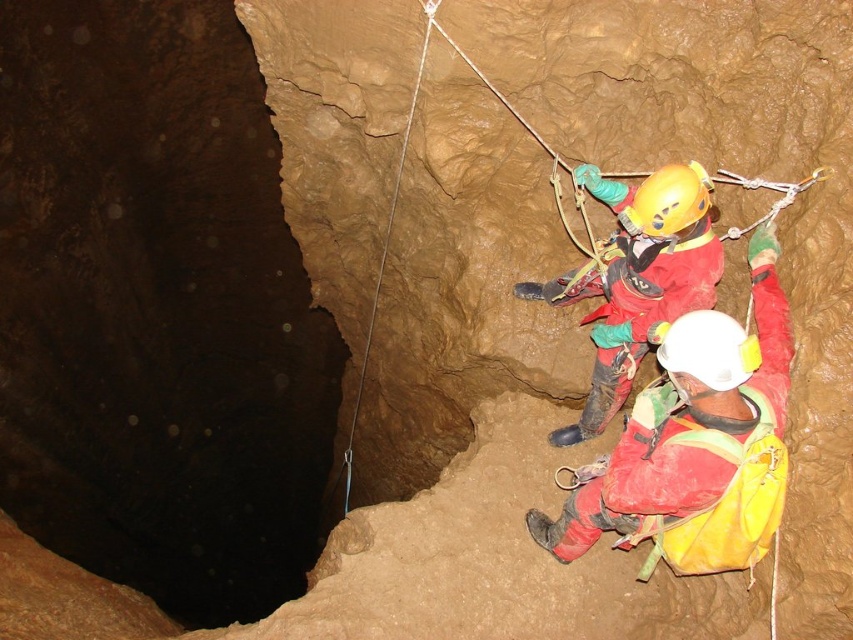
From the picture: You are a caver who needs to navigate through the cave. You see two points marked on the cave wall. The first point is at coordinate point (666,355) and the second point is at coordinate point (628,209). Which point is closer to you as you face the cave wall?

Point (666,355) is in front of point (628,209), so it is closer to you as you face the cave wall.

You are a safety officer assessing the cave setup. You see the white matte helmet at center and the yellow matte helmet at center. Which helmet is positioned closer to the entrance of the cave?

The white matte helmet at center is closer to the entrance of the cave because it is closer to the viewer than the yellow matte helmet at center, implying it is nearer to the cave entrance where the light source originates.

You are a cave explorer trying to locate a specific point marked at coordinates (695,445) in the cave. Based on the scene description, which object is this point located on?

The point is located on the red matte helmet at right.